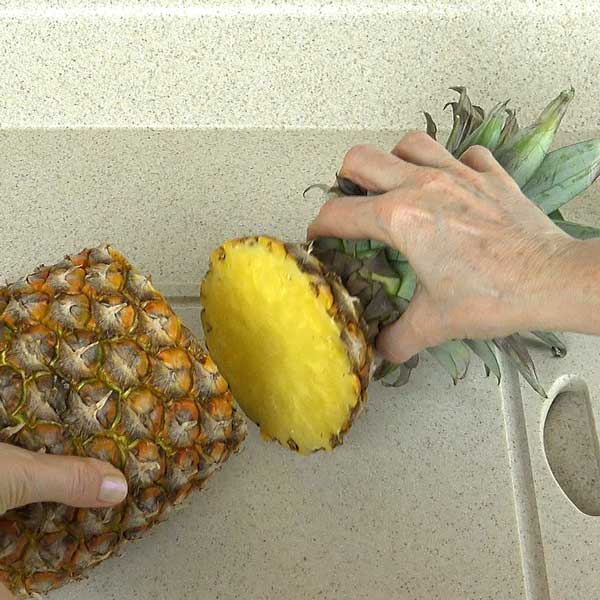
Identify the location of terrazzo trim/backsplash. This screenshot has height=600, width=600. (223, 77).